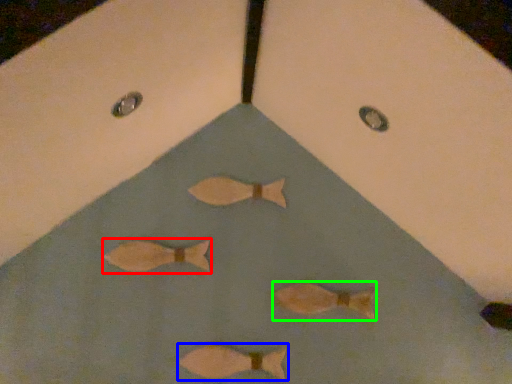
Question: Based on their relative distances, which object is farther from fish (highlighted by a red box)? Choose from fish (highlighted by a blue box) and fish (highlighted by a green box).

Choices:
 (A) fish
 (B) fish

Answer: (B)